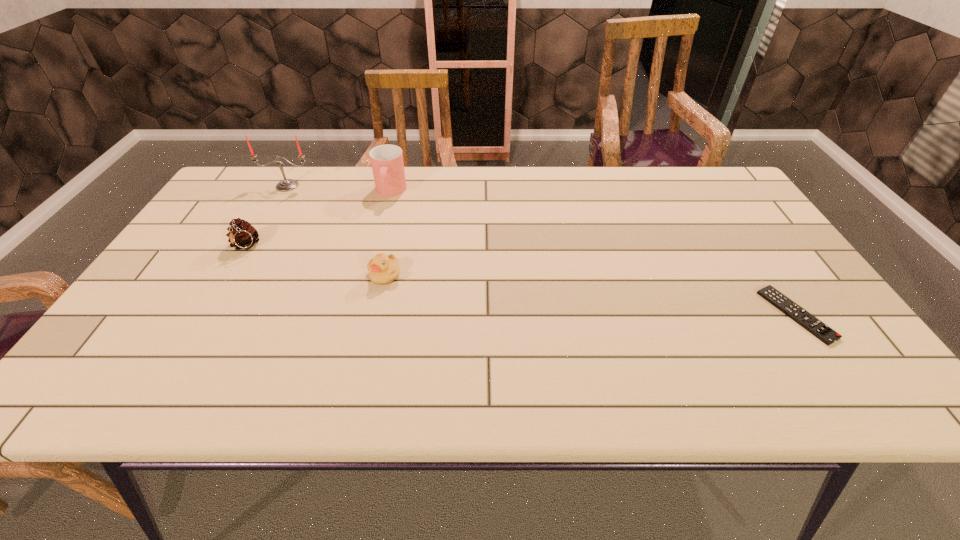
You are a GUI agent. You are given a task and a screenshot of the screen. Output one action in this format:
    pyautogui.click(x=<x>, y=<y>)
    Task: Click on the unoccupied area between the nearest object and the cup
    The image size is (960, 540).
    Given the screenshot: What is the action you would take?
    pyautogui.click(x=593, y=253)

This screenshot has height=540, width=960. In order to click on vacant space that is in between the candle and the nearest object in this screenshot , I will do `click(541, 251)`.

Identify the location of free space between the nearest object and the pinecone. Image resolution: width=960 pixels, height=540 pixels. (520, 281).

The height and width of the screenshot is (540, 960). Find the location of `free space that is in between the shortest object and the second shortest object`. free space that is in between the shortest object and the second shortest object is located at coordinates (590, 295).

You are a GUI agent. You are given a task and a screenshot of the screen. Output one action in this format:
    pyautogui.click(x=<x>, y=<y>)
    Task: Click on the empty space that is in between the cup and the fourth farthest object
    
    Given the screenshot: What is the action you would take?
    pyautogui.click(x=388, y=233)

Find the location of a particular element. Image resolution: width=960 pixels, height=540 pixels. vacant area between the third shortest object and the remote control is located at coordinates (520, 281).

Identify which object is located as the fourth nearest to the tallest object. Please provide its 2D coordinates. Your answer should be formatted as a tuple, i.e. [(x, y)], where the tuple contains the x and y coordinates of a point satisfying the conditions above.

[(820, 330)]

Find the location of a particular element. This screenshot has height=540, width=960. the second closest object to the duckling is located at coordinates (241, 234).

I want to click on free space that satisfies the following two spatial constraints: 1. with a leaf charm attached to the third shortest object; 2. on the left side of the rightmost object, so click(x=204, y=315).

Identify the location of vacant region that satisfies the following two spatial constraints: 1. on the front-facing side of the shortest object; 2. on the left side of the candle. (213, 315).